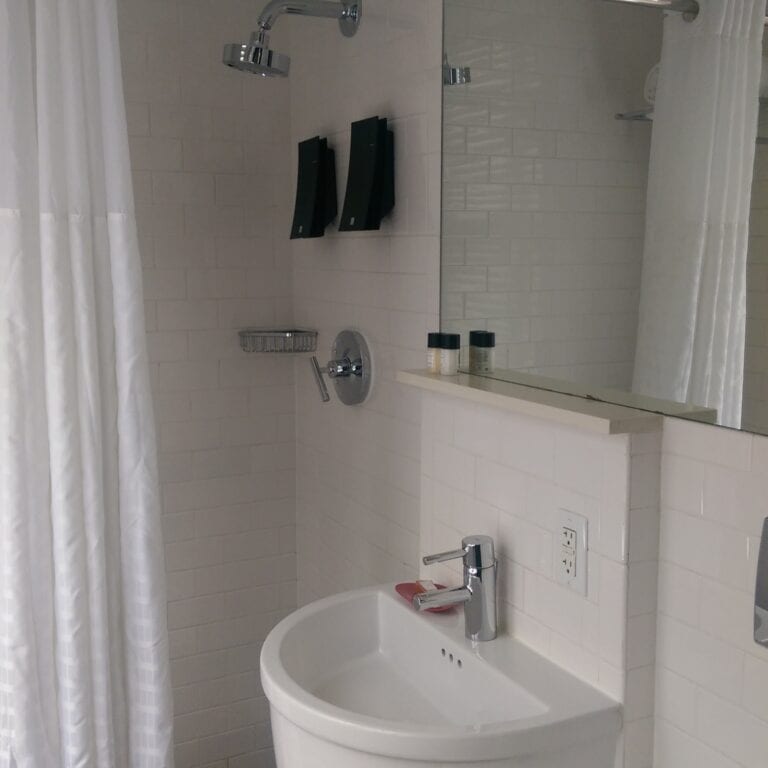
Locate an element on the screen. silver tap is located at coordinates (475, 580).